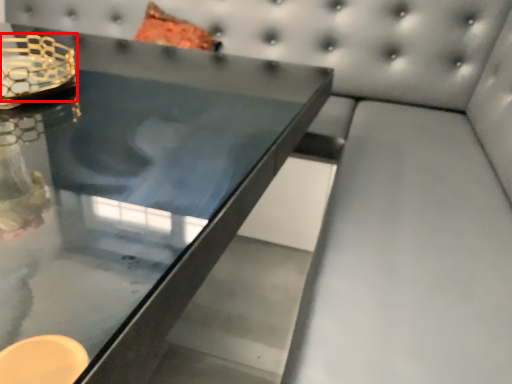
Question: From the image, what is the correct spatial relationship of candle holder (annotated by the red box) in relation to table?

Choices:
 (A) left
 (B) right

Answer: (A)